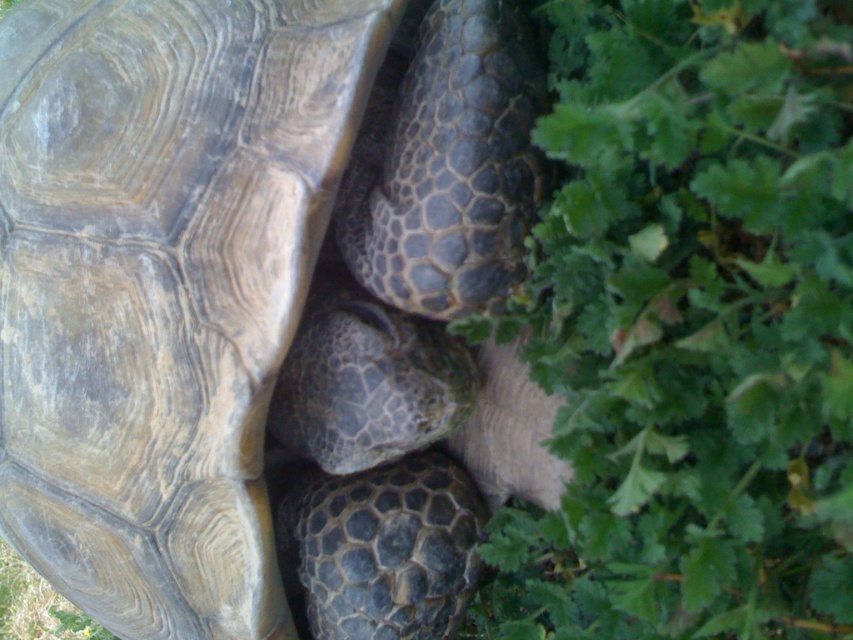
Question: Which point is closer to the camera?

Choices:
 (A) (148, 243)
 (B) (483, 618)

Answer: (A)

Question: Which of the following is the farthest from the observer?

Choices:
 (A) green leafy plant at lower right
 (B) leathery brown tortoise at center

Answer: (B)

Question: Which point appears farthest from the camera in this image?

Choices:
 (A) (703, 490)
 (B) (561, 474)

Answer: (B)

Question: Does leathery brown tortoise at center have a smaller size compared to green leafy plant at lower right?

Choices:
 (A) no
 (B) yes

Answer: (A)

Question: Can you confirm if leathery brown tortoise at center is positioned above green leafy plant at lower right?

Choices:
 (A) yes
 (B) no

Answer: (A)

Question: Is leathery brown tortoise at center below green leafy plant at lower right?

Choices:
 (A) yes
 (B) no

Answer: (B)